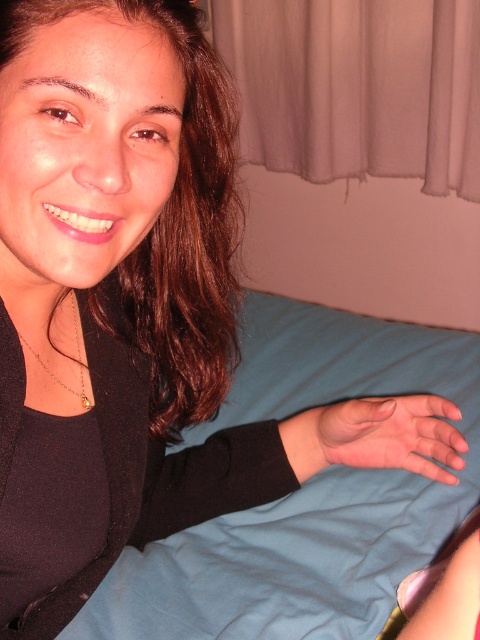
Based on the photo, you are a photographer setting up a portrait shoot in this scene. You need to ensure that the pink smooth skin at center and the gold chain necklace at left are both visible in the frame. Given their sizes, which object should you focus on to ensure both are clearly captured without cropping?

The pink smooth skin at center is bigger than the gold chain necklace at left. To ensure both are clearly captured without cropping, focus on the larger object, the pink smooth skin at center, as it requires more space in the frame.

You are trying to place a small lamp on the blue fabric bed at center. According to the coordinates provided, where exactly should you position the lamp to ensure it is centered on the bed?

The blue fabric bed at center is located at point (303, 493), so you should place the lamp at those coordinates to center it on the bed.